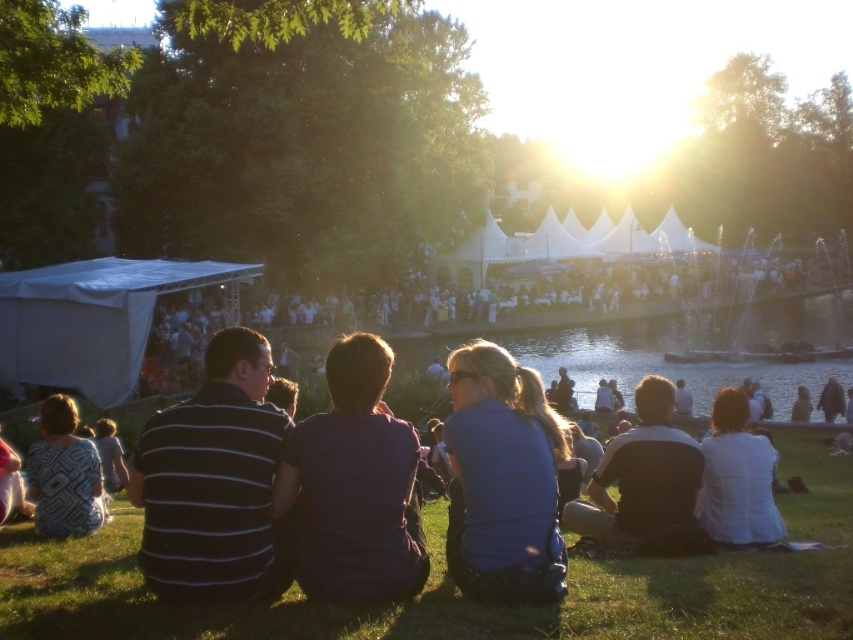
Does point (450, 602) lie behind point (497, 582)?

Yes.

Can you confirm if green grass at lower center is positioned below blue matte shirt at center?

Correct, green grass at lower center is located below blue matte shirt at center.

Is point (622, 588) positioned before point (456, 426)?

Yes, point (622, 588) is closer to viewer.

At what (x,y) coordinates should I click in order to perform the action: click on green grass at lower center. Please return your answer as a coordinate pair (x, y). This screenshot has height=640, width=853. Looking at the image, I should click on (465, 596).

Between point (694, 531) and point (57, 520), which one is positioned in front?

Positioned in front is point (694, 531).

Who is more distant from viewer, [698,541] or [105,513]?

Point [105,513]

Is point (593, 476) in front of point (62, 468)?

That is True.

The height and width of the screenshot is (640, 853). I want to click on dark gray shirt at center, so click(645, 483).

Is green grass at lower center positioned behind dark purple fabric shirt at center?

No, it is not.

Is green grass at lower center above dark purple fabric shirt at center?

No, green grass at lower center is not above dark purple fabric shirt at center.

You are a GUI agent. You are given a task and a screenshot of the screen. Output one action in this format:
    pyautogui.click(x=<x>, y=<y>)
    Task: Click on the green grass at lower center
    The width and height of the screenshot is (853, 640).
    Given the screenshot: What is the action you would take?
    pyautogui.click(x=465, y=596)